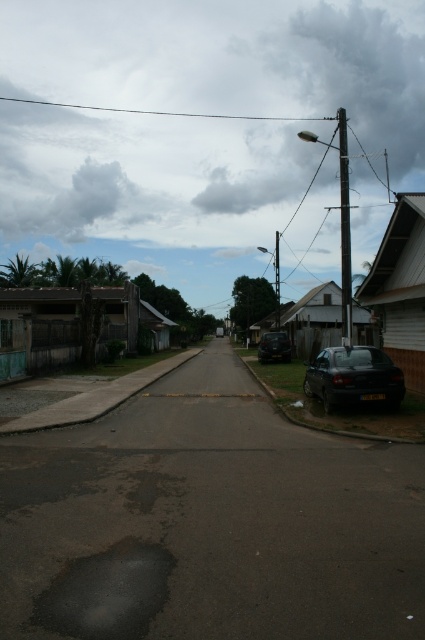
Is black wire at upper center smaller than shiny black car at center?

No.

Who is positioned more to the right, black wire at upper center or shiny black car at center?

Positioned to the right is shiny black car at center.

You are a GUI agent. You are given a task and a screenshot of the screen. Output one action in this format:
    pyautogui.click(x=<x>, y=<y>)
    Task: Click on the black wire at upper center
    The height and width of the screenshot is (640, 425).
    Given the screenshot: What is the action you would take?
    pyautogui.click(x=159, y=112)

You are a GUI agent. You are given a task and a screenshot of the screen. Output one action in this format:
    pyautogui.click(x=<x>, y=<y>)
    Task: Click on the black wire at upper center
    Image resolution: width=425 pixels, height=640 pixels.
    Given the screenshot: What is the action you would take?
    pyautogui.click(x=159, y=112)

Who is positioned more to the right, shiny black car at lower right or shiny black car at center?

Positioned to the right is shiny black car at center.

How much distance is there between shiny black car at lower right and shiny black car at center?

shiny black car at lower right is 22.00 meters away from shiny black car at center.

Is point (368, 394) closer to camera compared to point (283, 353)?

Yes, point (368, 394) is closer to viewer.

Where is `shiny black car at lower right`? The height and width of the screenshot is (640, 425). shiny black car at lower right is located at coordinates (354, 378).

Is point (384, 358) closer to viewer compared to point (138, 113)?

Yes, point (384, 358) is in front of point (138, 113).

Does point (394, 390) come behind point (133, 109)?

That is False.

Describe the element at coordinates (354, 378) in the screenshot. The image size is (425, 640). I see `shiny black car at lower right` at that location.

The image size is (425, 640). I want to click on shiny black car at lower right, so click(x=354, y=378).